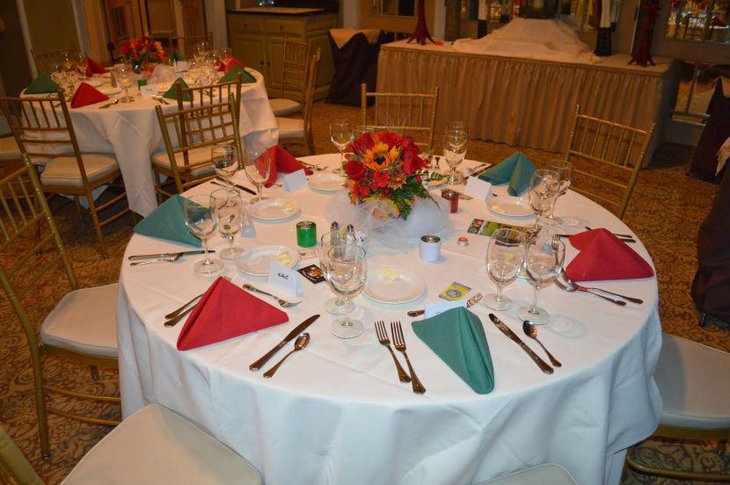
The height and width of the screenshot is (485, 730). I want to click on candle, so click(307, 233).